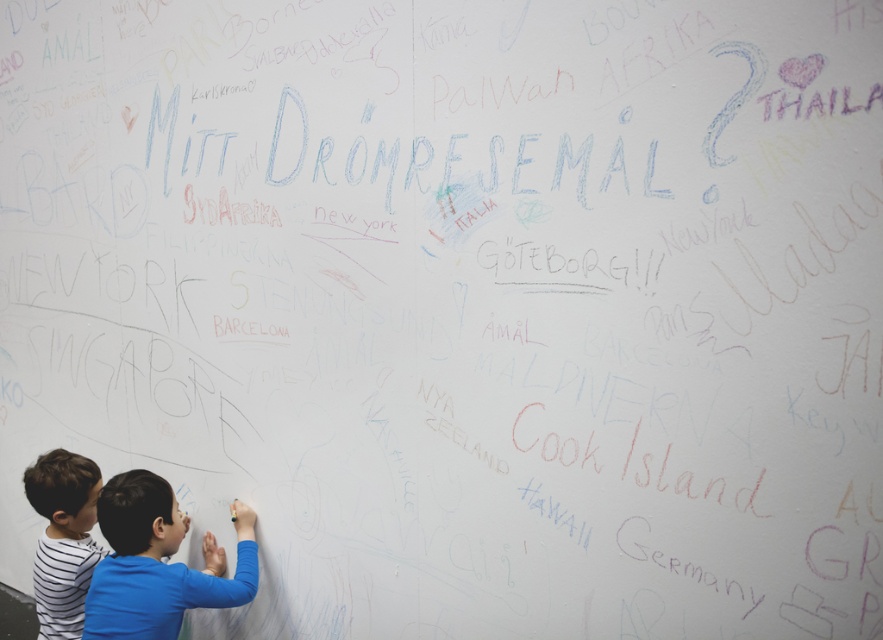
Question: In this image, where is blue shirt at lower left located relative to striped cotton shirt at lower left?

Choices:
 (A) above
 (B) below

Answer: (A)

Question: Among these objects, which one is farthest from the camera?

Choices:
 (A) blue shirt at lower left
 (B) striped cotton shirt at lower left

Answer: (B)

Question: Can you confirm if blue shirt at lower left is smaller than striped cotton shirt at lower left?

Choices:
 (A) yes
 (B) no

Answer: (B)

Question: Is blue shirt at lower left closer to camera compared to striped cotton shirt at lower left?

Choices:
 (A) yes
 (B) no

Answer: (A)